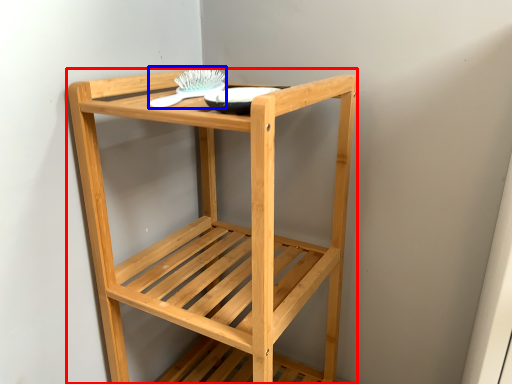
Question: Which of the following is the farthest to the observer, furniture (highlighted by a red box) or brush (highlighted by a blue box)?

Choices:
 (A) furniture
 (B) brush

Answer: (B)